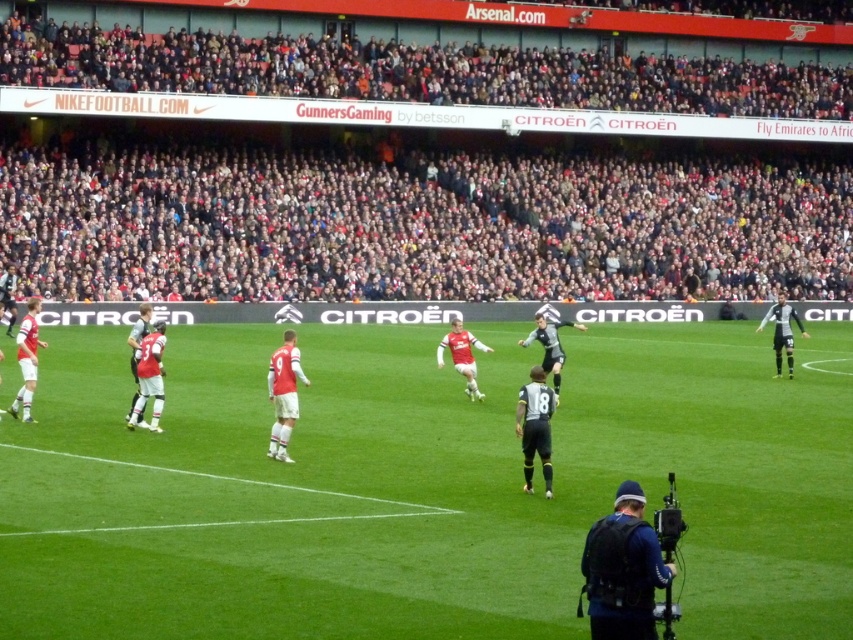
Question: Does black uniform at lower right come in front of matte red jersey at center?

Choices:
 (A) no
 (B) yes

Answer: (B)

Question: Is green grass football field at center below matte red jersey at center?

Choices:
 (A) yes
 (B) no

Answer: (A)

Question: Where is dark gray crowd at upper center located in relation to black uniform at lower right in the image?

Choices:
 (A) below
 (B) above

Answer: (B)

Question: Which object appears closest to the camera in this image?

Choices:
 (A) black uniform at lower right
 (B) matte red jersey at center
 (C) dark gray crowd at upper center

Answer: (A)

Question: Which is nearer to the green grass football field at center?

Choices:
 (A) black uniform at lower right
 (B) dark gray jersey at right

Answer: (B)

Question: Which point is closer to the camera taking this photo?

Choices:
 (A) (618, 628)
 (B) (769, 314)

Answer: (A)